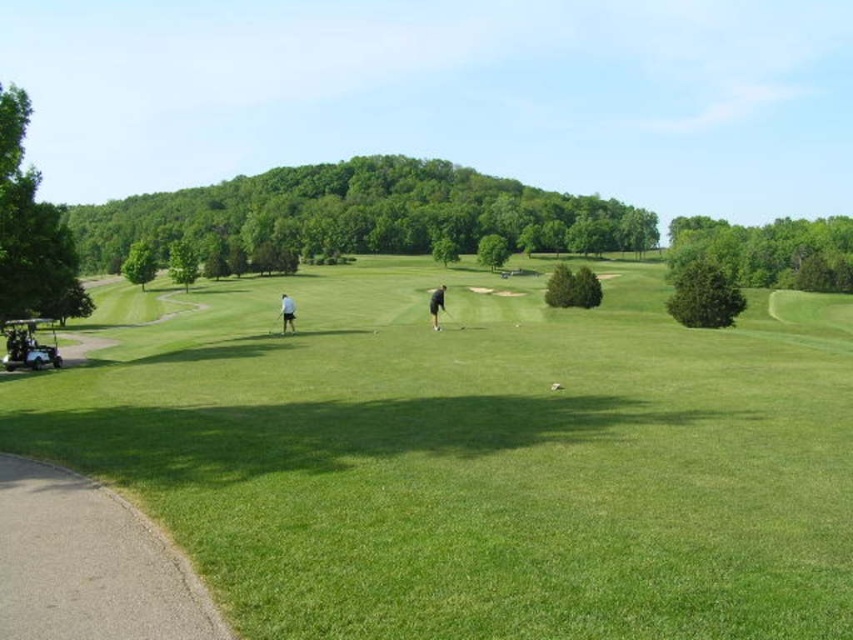
Question: Can you confirm if dark gray pants at center is positioned to the right of black rubber golf club at center?

Choices:
 (A) yes
 (B) no

Answer: (B)

Question: Is green grassy field at center smaller than dark gray pants at center?

Choices:
 (A) no
 (B) yes

Answer: (A)

Question: Estimate the real-world distances between objects in this image. Which object is closer to the metallic silver golf club at center?

Choices:
 (A) matte black golf cart at lower left
 (B) black rubber golf club at center
 (C) dark gray pants at center
 (D) white fabric shirt at center

Answer: (D)

Question: Is matte black golf cart at lower left to the right of white fabric shirt at center from the viewer's perspective?

Choices:
 (A) yes
 (B) no

Answer: (B)

Question: Which of the following is the closest to the observer?

Choices:
 (A) (32, 337)
 (B) (434, 291)
 (C) (280, 317)

Answer: (A)

Question: Which of the following is the closest to the observer?

Choices:
 (A) (276, 314)
 (B) (9, 346)
 (C) (61, 422)

Answer: (C)